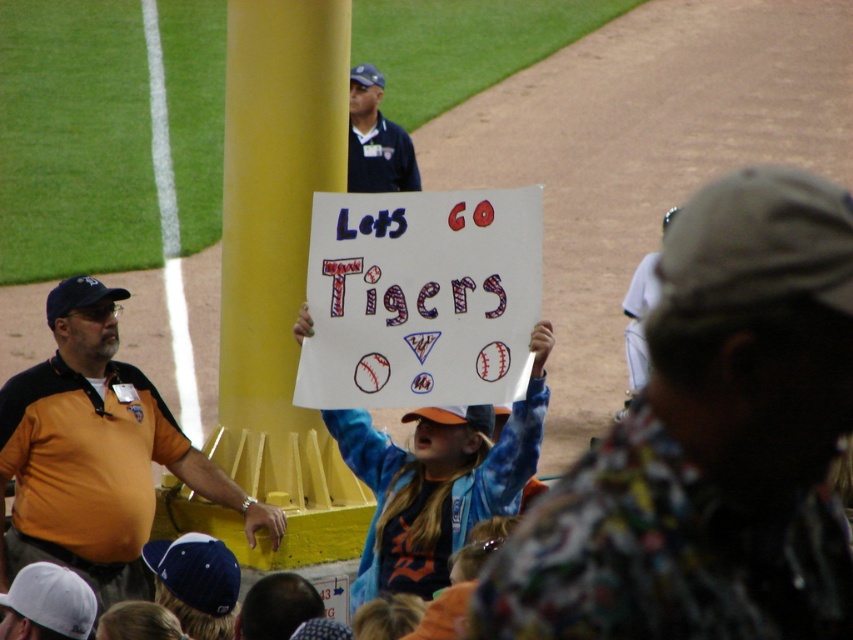
You are a photographer at the baseball game and want to take a picture of the yellow painted pole at center. What are the coordinates where you should aim your camera?

The yellow painted pole at center is located at coordinates point (276, 241).

You are a photographer standing at the center of the baseball field. You want to take a photo that includes both the point at coordinates point (634, 600) and point (383, 144). Which point should you focus on first to ensure both are in focus?

You should focus on point (383, 144) first because it is farther from the camera than point (634, 600). By focusing on the farther point, the closer point will also be within the depth of field.